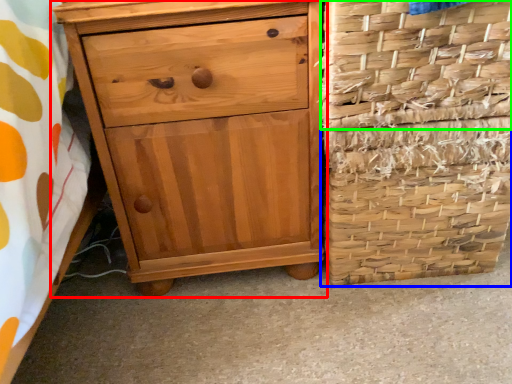
Question: Which object is positioned closest to chest of drawers (highlighted by a red box)? Select from basket container (highlighted by a blue box) and basket (highlighted by a green box).

Choices:
 (A) basket container
 (B) basket

Answer: (A)